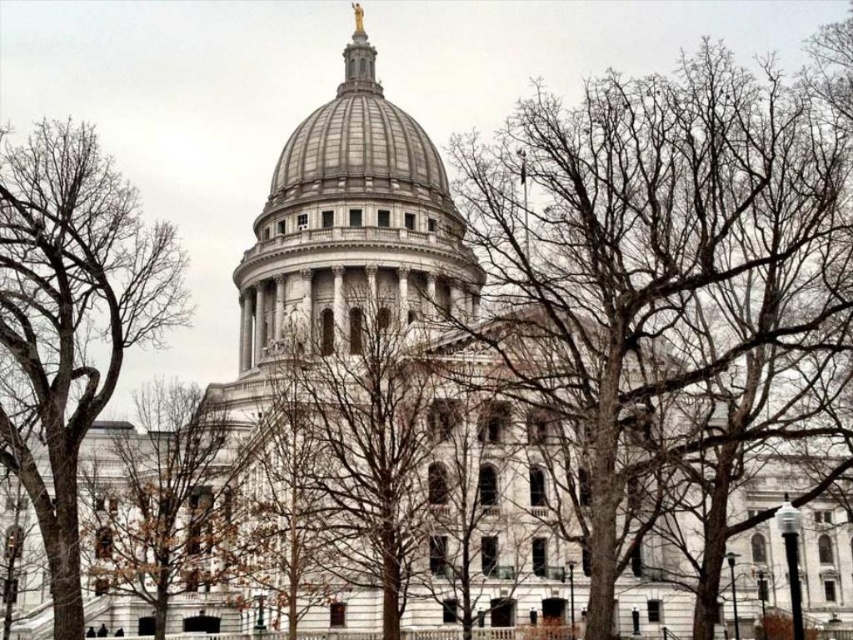
You are standing in front of the grand neoclassical building and notice two trees. The first is the bare branches at center, and the second is the brown leafless tree at lower left. Which tree is closer to you?

The bare branches at center is closer to you because it is in front of the brown leafless tree at lower left.

You are standing in front of the grand neoclassical building with its large dome and golden statue. You see two points marked in the image. Which point is closer to you, point (x=386, y=451) or point (x=86, y=516)?

Point (x=386, y=451) is closer to the camera than point (x=86, y=516).